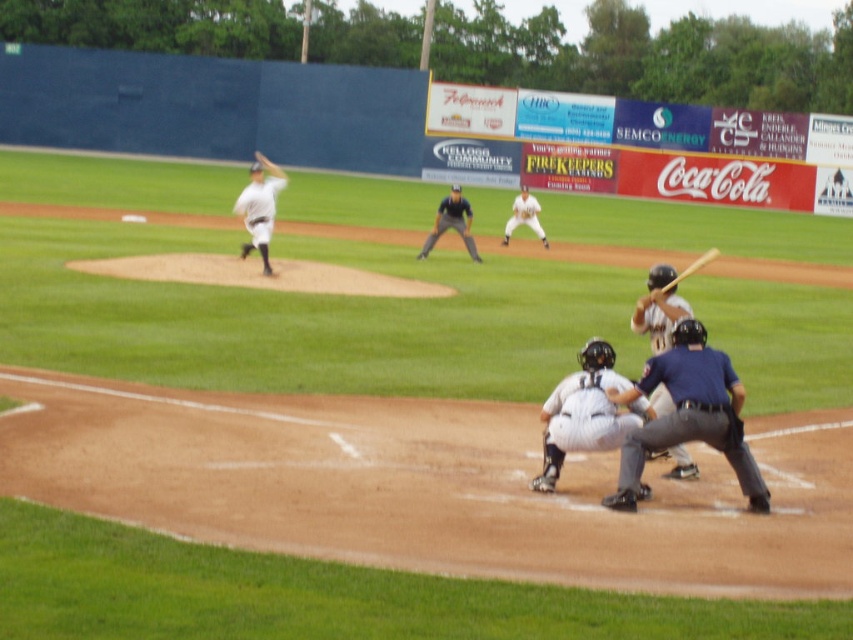
Question: Which point is farther to the camera?

Choices:
 (A) (508, 241)
 (B) (672, 305)

Answer: (A)

Question: Which object is farther from the camera taking this photo?

Choices:
 (A) dark gray uniform at center
 (B) white matte baseball player at center
 (C) dark blue uniform at center

Answer: (B)

Question: Is white matte baseball pitcher at upper left smaller than wooden baseball bat at center?

Choices:
 (A) no
 (B) yes

Answer: (A)

Question: Can you confirm if white matte baseball pitcher at upper left is thinner than wooden baseball bat at center?

Choices:
 (A) no
 (B) yes

Answer: (A)

Question: Does white matte baseball pitcher at upper left have a smaller size compared to wooden baseball bat at center?

Choices:
 (A) yes
 (B) no

Answer: (B)

Question: Which object appears farthest from the camera in this image?

Choices:
 (A) white matte uniform at center
 (B) white matte baseball player at center
 (C) wooden baseball bat at center

Answer: (B)